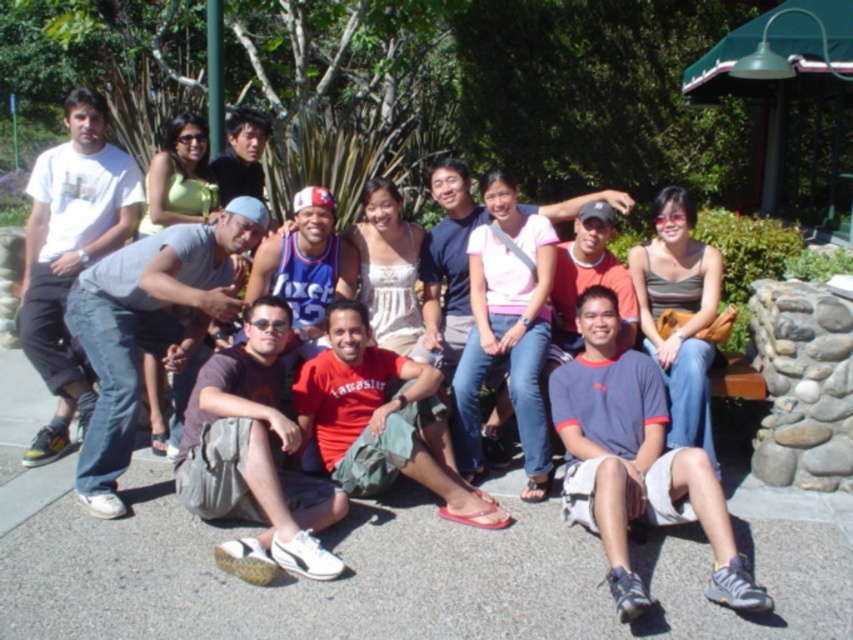
You are standing at the center of the group and want to pick up an item located at point (254, 458). What item is at that location?

The dark gray fabric bag at lower center is located at point (254, 458).

You are a photographer trying to position two subjects in the image for a better composition. The subjects are wearing the gray denim jeans at center and the red matte shirt at center. Which subject should you move to the right to create symmetry between them?

You should move the gray denim jeans at center to the right since it is currently to the left of the red matte shirt at center, so shifting it right would align them symmetrically.

You are taking a photo of the group in the park. You want to focus on the person at point (286,436) and the person at point (318,248). Which of these two points is closer to the camera?

Point (286,436) is closer to the camera than point (318,248).